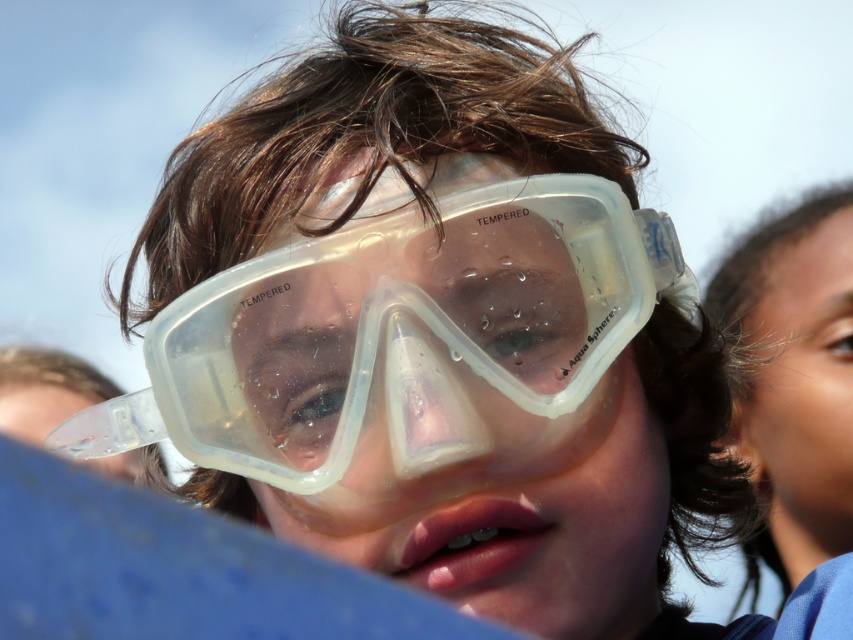
Question: Which of the following is the farthest from the observer?

Choices:
 (A) transparent plastic goggles at center
 (B) smooth skin face at upper right

Answer: (B)

Question: Can you confirm if transparent plastic goggles at center is wider than smooth skin face at upper right?

Choices:
 (A) yes
 (B) no

Answer: (B)

Question: Can you confirm if transparent plastic goggles at center is thinner than smooth skin face at upper right?

Choices:
 (A) yes
 (B) no

Answer: (A)

Question: Does transparent plastic goggles at center have a larger size compared to smooth skin face at upper right?

Choices:
 (A) no
 (B) yes

Answer: (A)